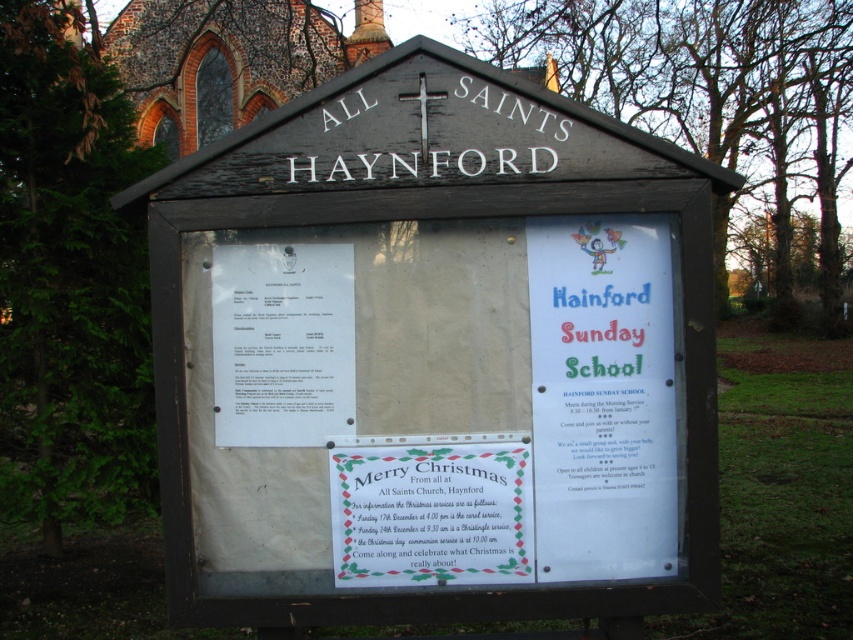
Between white paper poster at center and white paper sign at center, which one has less height?

white paper sign at center is shorter.

Is white paper poster at center thinner than white paper sign at center?

Yes.

Image resolution: width=853 pixels, height=640 pixels. Describe the element at coordinates (602, 397) in the screenshot. I see `white paper poster at center` at that location.

What are the coordinates of `white paper poster at center` in the screenshot? It's located at (602, 397).

Who is positioned more to the left, white paper poster at center or white paper at left?

Positioned to the left is white paper at left.

Does white paper poster at center appear on the left side of white paper at left?

Incorrect, white paper poster at center is not on the left side of white paper at left.

Between point (589, 468) and point (289, 244), which one is positioned in front?

Point (589, 468) is in front.

Where is `white paper poster at center`? white paper poster at center is located at coordinates (602, 397).

Between white paper sign at center and white paper at left, which one has more height?

white paper at left is taller.

Is white paper sign at center bigger than white paper at left?

Yes, white paper sign at center is bigger than white paper at left.

At what (x,y) coordinates should I click in order to perform the action: click on white paper sign at center. Please return your answer as a coordinate pair (x, y). This screenshot has width=853, height=640. Looking at the image, I should click on (430, 509).